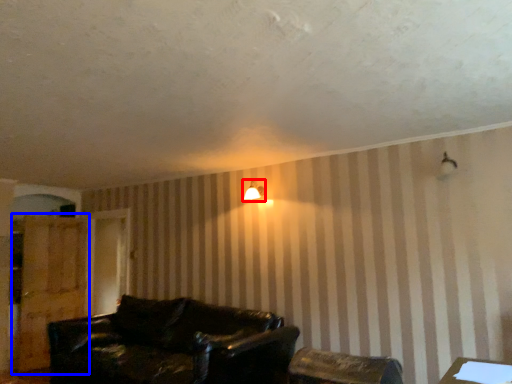
Question: Among these objects, which one is nearest to the camera, lamp (highlighted by a red box) or dresser (highlighted by a blue box)?

Choices:
 (A) lamp
 (B) dresser

Answer: (A)